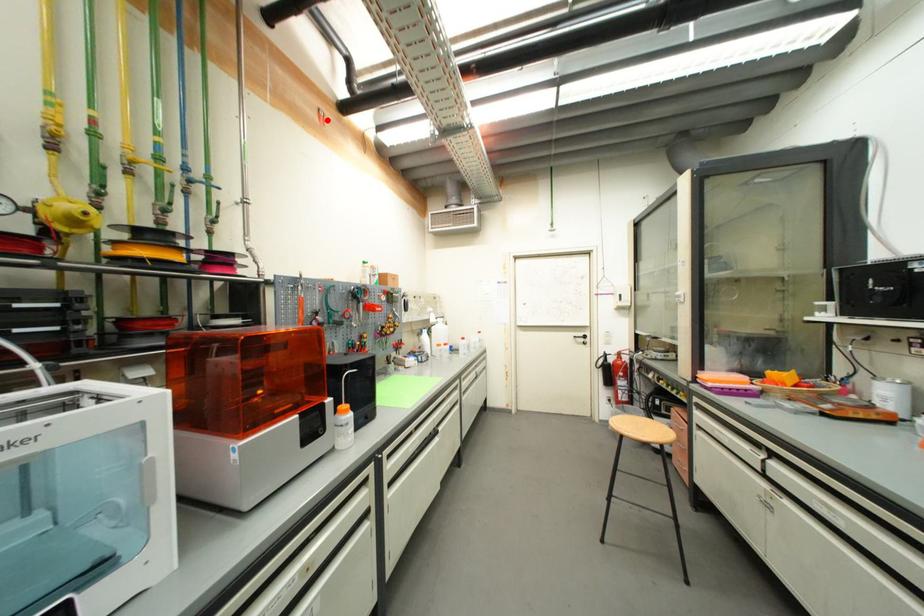
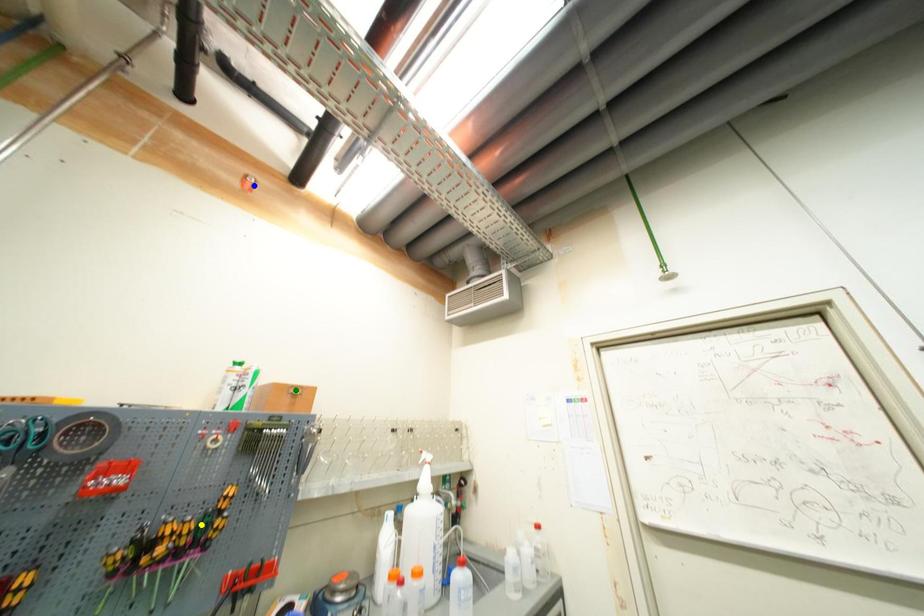
Question: I am providing you with two images of the same scene from different viewpoints. A red point is marked on the first image. You are given multiple points on the second image. Which spot in image 2 lines up with the point in image 1?

Choices:
 (A) green point
 (B) blue point
 (C) yellow point

Answer: (B)